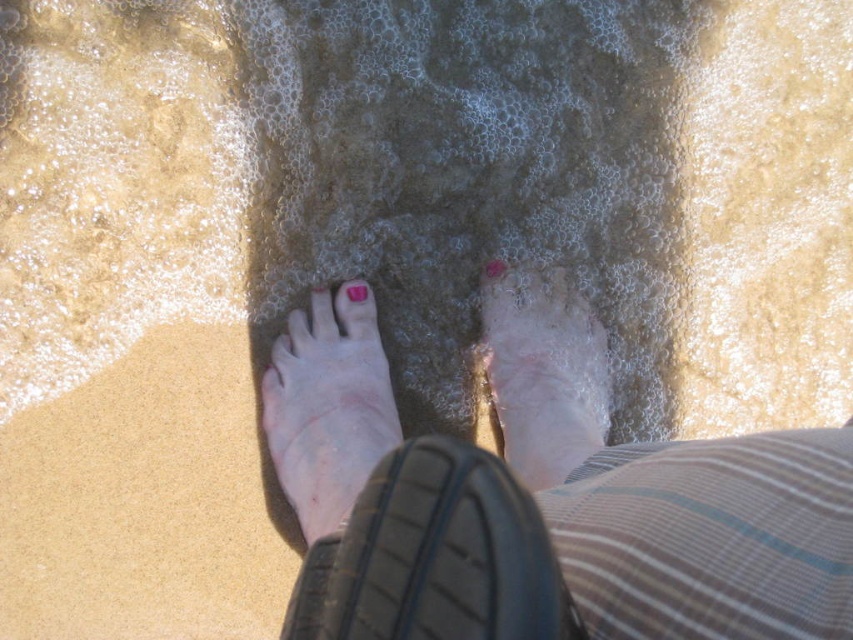
Between pink painted toenails at center and pink matte toe at center, which one is positioned lower?

pink painted toenails at center

Is point (473, 609) positioned behind point (486, 275)?

No, (473, 609) is closer to viewer.

This screenshot has height=640, width=853. Identify the location of pink painted toenails at center. (543, 497).

Is point (408, 468) behind point (595, 426)?

That is False.

You are a GUI agent. You are given a task and a screenshot of the screen. Output one action in this format:
    pyautogui.click(x=<x>, y=<y>)
    Task: Click on the black rubber shoe at lower center
    Image resolution: width=853 pixels, height=640 pixels.
    Given the screenshot: What is the action you would take?
    pyautogui.click(x=434, y=556)

At what (x,y) coordinates should I click in order to perform the action: click on black rubber shoe at lower center. Please return your answer as a coordinate pair (x, y). The height and width of the screenshot is (640, 853). Looking at the image, I should click on (434, 556).

Can you confirm if pink painted toenails at center is bigger than black rubber shoe at lower center?

Correct, pink painted toenails at center is larger in size than black rubber shoe at lower center.

Who is taller, pink painted toenails at center or black rubber shoe at lower center?

pink painted toenails at center

Does point (573, 556) lie behind point (398, 541)?

That is True.

Find the location of a particular element. The height and width of the screenshot is (640, 853). pink painted toenails at center is located at coordinates (543, 497).